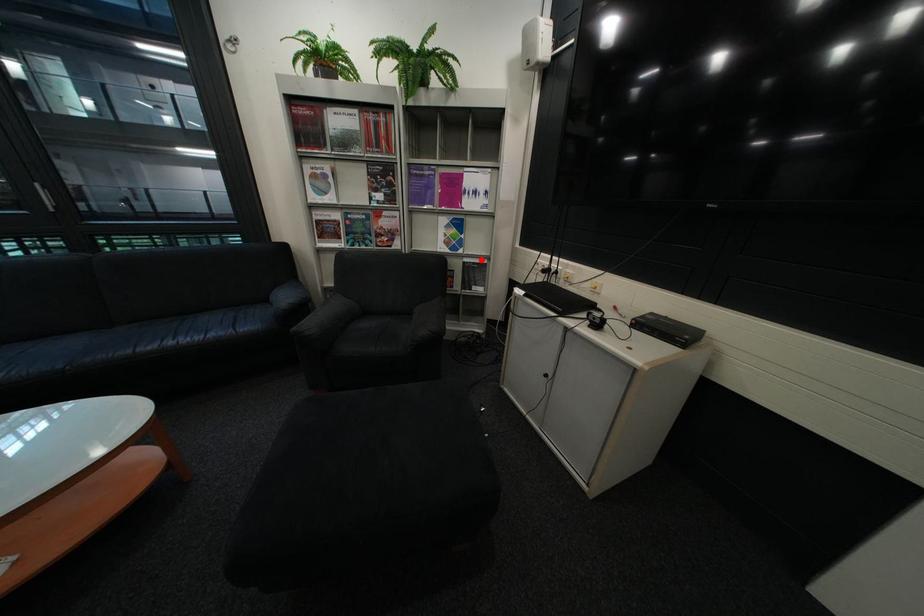
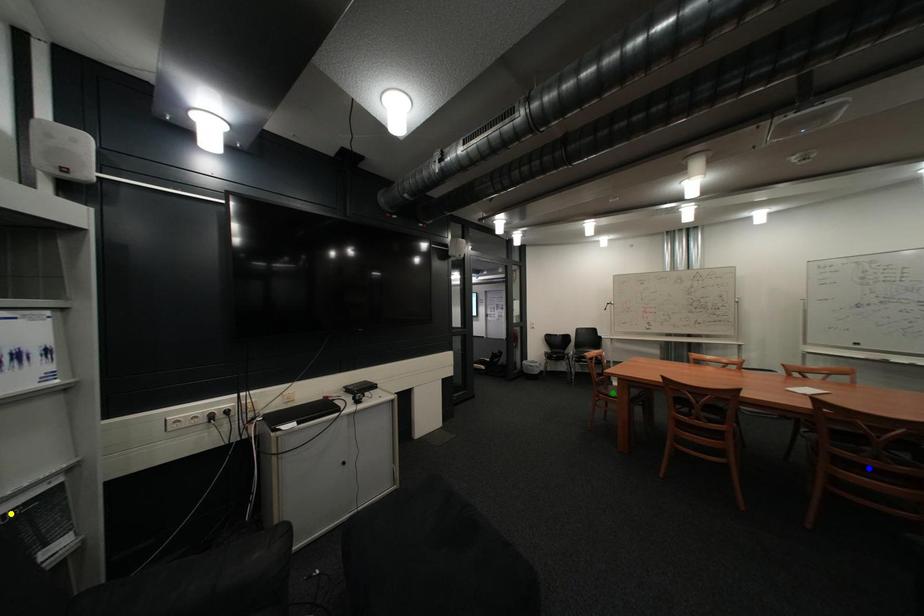
Question: I am providing you with two images of the same scene from different viewpoints. A red point is marked on the first image. You are given multiple points on the second image. Which point in image 2 represents the same 3d spot as the red point in image 1?

Choices:
 (A) yellow point
 (B) green point
 (C) blue point

Answer: (A)